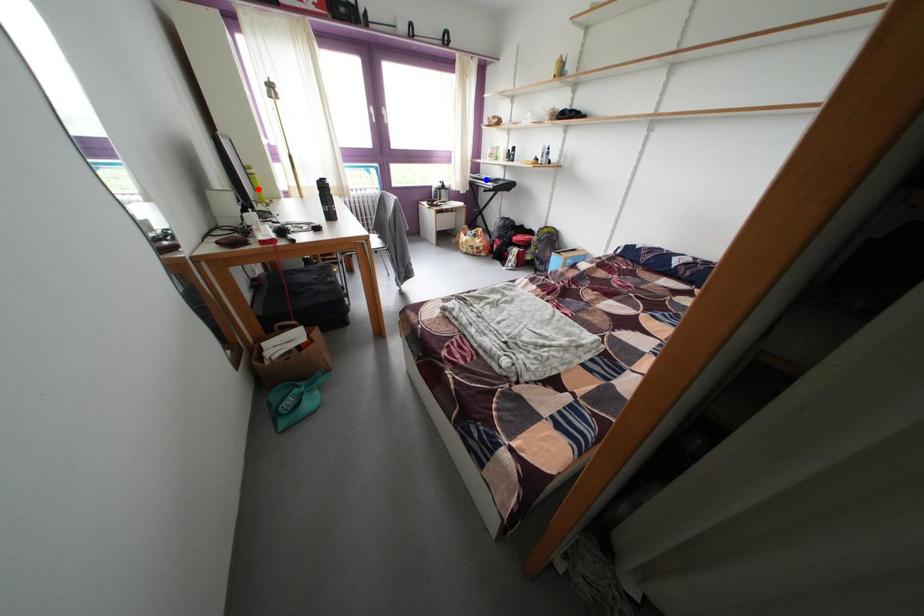
Question: Two points are marked on the image. Which point is closer to the camera?

Choices:
 (A) Blue point is closer.
 (B) Red point is closer.

Answer: (B)